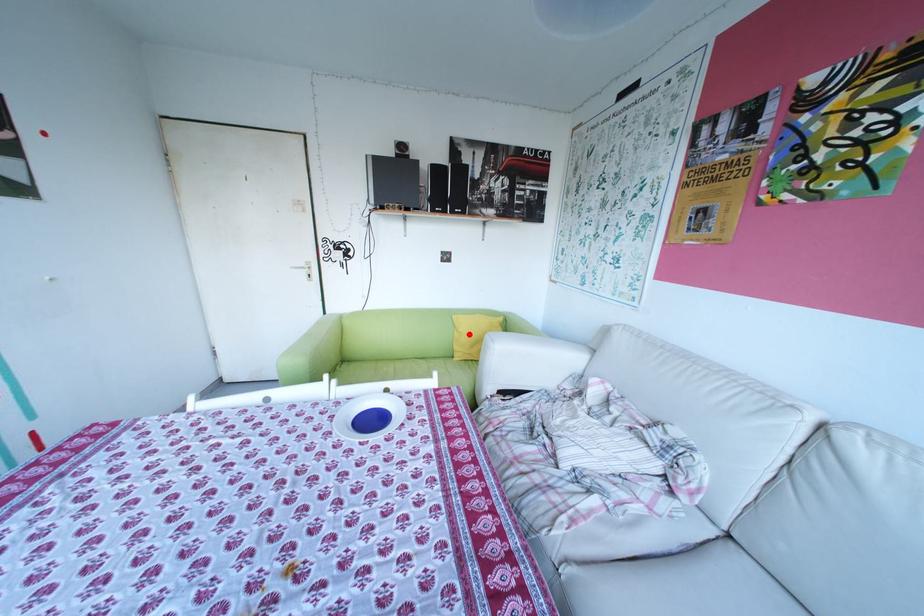
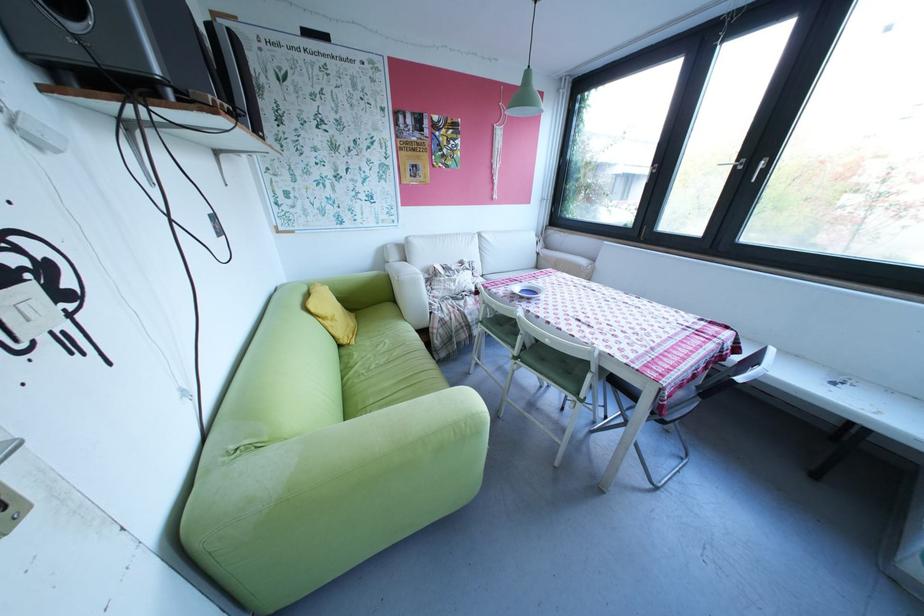
In the second image, find the point that corresponds to the highlighted location in the first image.

(339, 323)